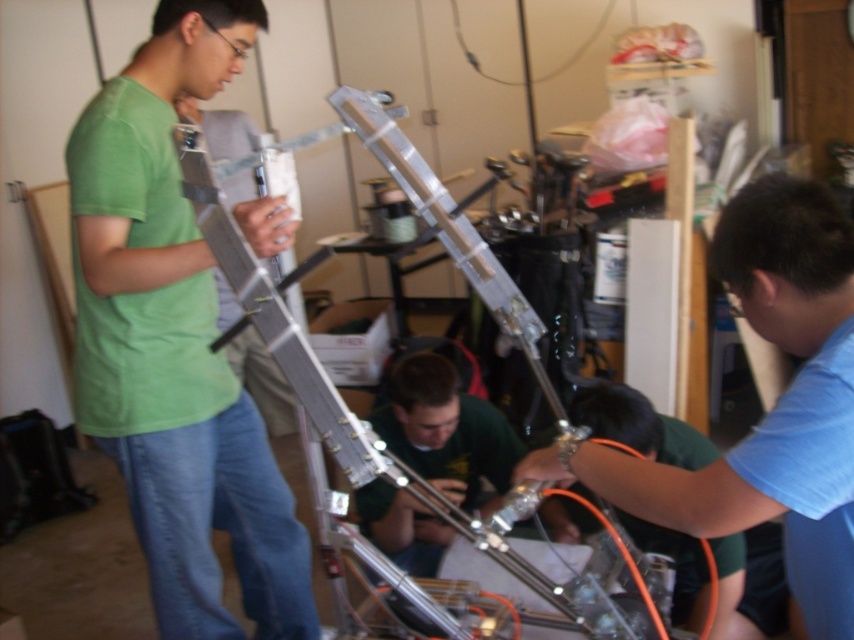
Question: Does blue matte shirt at lower right come in front of green fabric shirt at center?

Choices:
 (A) yes
 (B) no

Answer: (A)

Question: Which point is farther to the camera?

Choices:
 (A) blue matte shirt at lower right
 (B) green fabric shirt at center

Answer: (B)

Question: Does blue matte shirt at lower right come behind green fabric shirt at center?

Choices:
 (A) yes
 (B) no

Answer: (B)

Question: Which point appears closest to the camera in this image?

Choices:
 (A) (437, 435)
 (B) (828, 545)

Answer: (B)

Question: Is blue matte shirt at lower right to the right of green fabric shirt at center from the viewer's perspective?

Choices:
 (A) yes
 (B) no

Answer: (A)